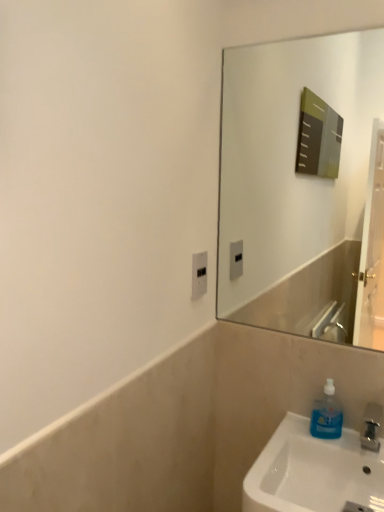
Question: From a real-world perspective, relative to blue translucent soap dispenser at lower right, is white plastic electric outlet at center vertically above or below?

Choices:
 (A) below
 (B) above

Answer: (B)

Question: Choose the correct answer: Is white plastic electric outlet at center inside blue translucent soap dispenser at lower right or outside it?

Choices:
 (A) outside
 (B) inside

Answer: (A)

Question: Relative to blue translucent soap dispenser at lower right, is white plastic electric outlet at center in front or behind?

Choices:
 (A) behind
 (B) front

Answer: (A)

Question: From the image's perspective, is blue translucent soap dispenser at lower right positioned above or below white plastic electric outlet at center?

Choices:
 (A) below
 (B) above

Answer: (A)

Question: Based on their sizes in the image, would you say blue translucent soap dispenser at lower right is bigger or smaller than white plastic electric outlet at center?

Choices:
 (A) small
 (B) big

Answer: (B)

Question: Choose the correct answer: Is blue translucent soap dispenser at lower right inside white plastic electric outlet at center or outside it?

Choices:
 (A) outside
 (B) inside

Answer: (A)

Question: In the image, is blue translucent soap dispenser at lower right positioned in front of or behind white plastic electric outlet at center?

Choices:
 (A) behind
 (B) front

Answer: (B)